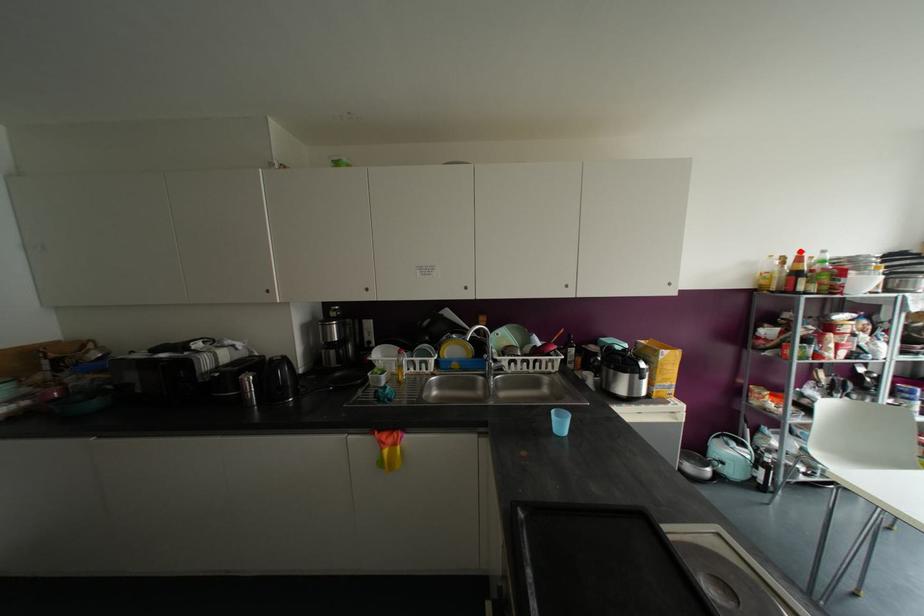
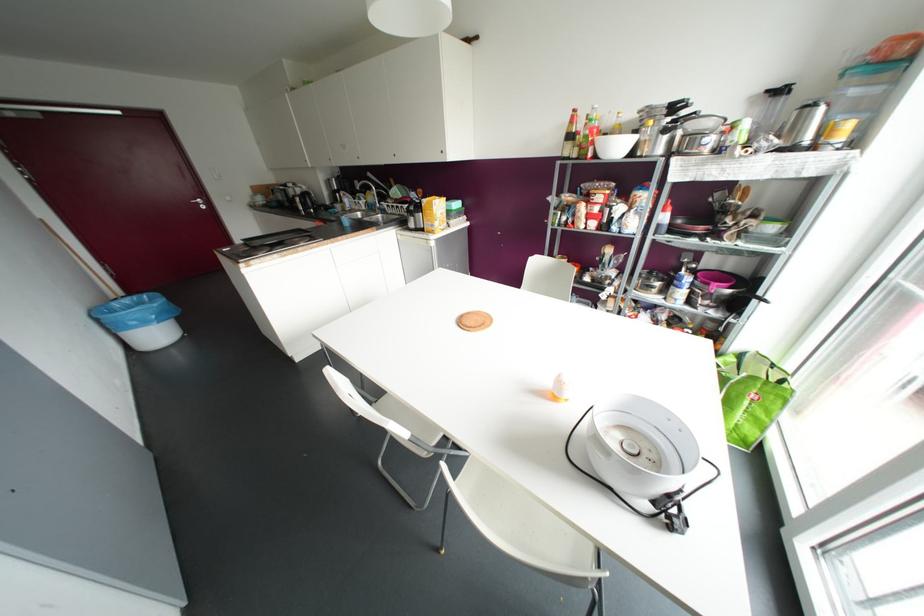
Locate, in the second image, the point that corresponds to the highlighted location in the first image.

(574, 110)